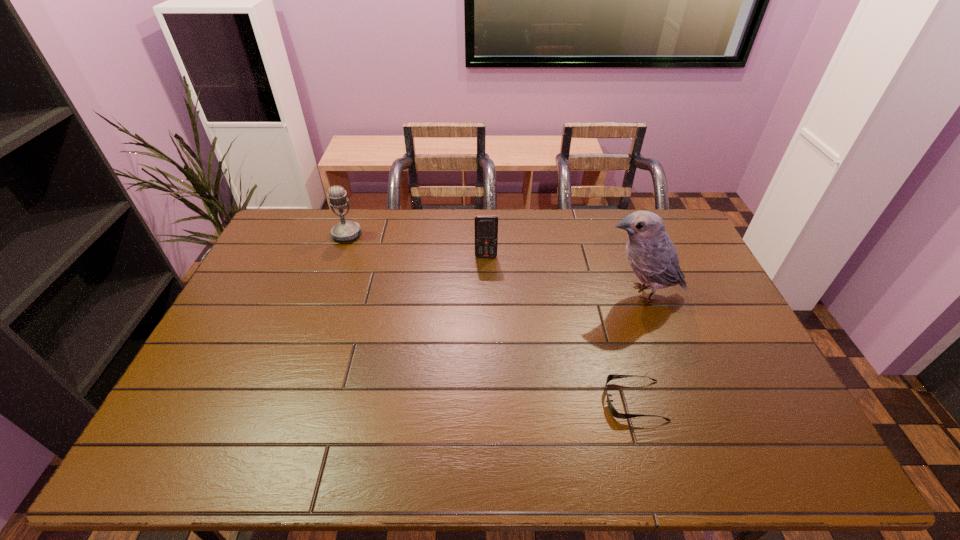
Where is `vacant space at the left edge of the desktop`? vacant space at the left edge of the desktop is located at coordinates (239, 352).

I want to click on vacant space at the right edge of the desktop, so click(x=755, y=385).

You are a GUI agent. You are given a task and a screenshot of the screen. Output one action in this format:
    pyautogui.click(x=<x>, y=<y>)
    Task: Click on the vacant region between the shortest object and the leftmost object
    This screenshot has width=960, height=540.
    Given the screenshot: What is the action you would take?
    pyautogui.click(x=491, y=318)

Image resolution: width=960 pixels, height=540 pixels. What are the coordinates of `free spot between the leftmost object and the tallest object` in the screenshot? It's located at (493, 265).

Find the location of `vacant area between the third nearest object and the sunglasses`. vacant area between the third nearest object and the sunglasses is located at coordinates (561, 328).

Find the location of `vacant point located between the microphone and the cellular telephone`. vacant point located between the microphone and the cellular telephone is located at coordinates (417, 246).

Find the location of `vacant region between the cellular telephone and the shortest object`. vacant region between the cellular telephone and the shortest object is located at coordinates (561, 328).

You are a GUI agent. You are given a task and a screenshot of the screen. Output one action in this format:
    pyautogui.click(x=<x>, y=<y>)
    Task: Click on the vacant point located between the microphone and the cellular telephone
    
    Given the screenshot: What is the action you would take?
    pyautogui.click(x=417, y=246)

This screenshot has width=960, height=540. I want to click on vacant point located between the microphone and the second nearest object, so click(493, 265).

Where is `free space between the tallest object and the nearest object`? free space between the tallest object and the nearest object is located at coordinates (637, 347).